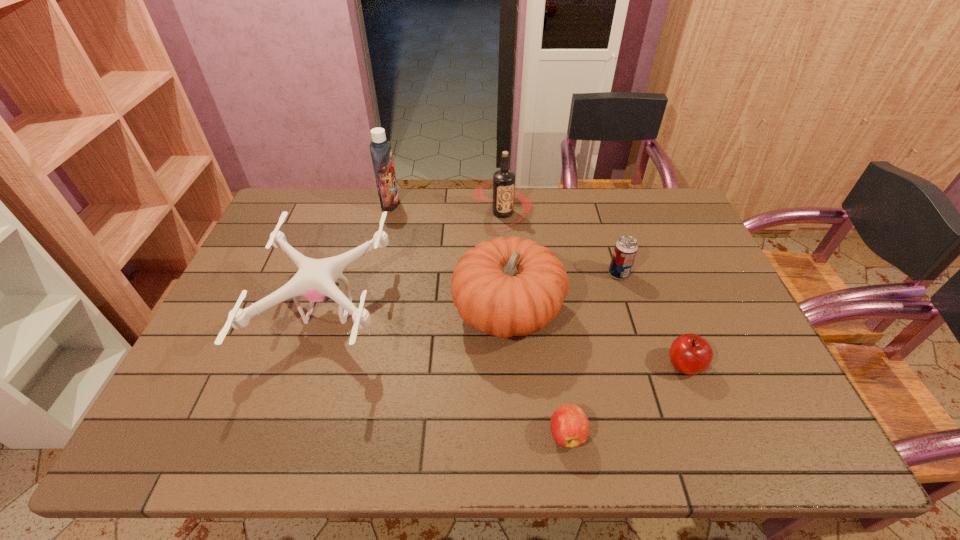
At what (x,y) coordinates should I click in order to perform the action: click on free point that satisfies the following two spatial constraints: 1. on the label of the root beer; 2. on the left side of the farther apple. Please return your answer as a coordinate pair (x, y). Looking at the image, I should click on point(513,365).

I want to click on vacant region that satisfies the following two spatial constraints: 1. on the front label of the shortest object; 2. on the right side of the tallest object, so click(333, 434).

Find the location of `free space in the image that satisfies the following two spatial constraints: 1. on the front label of the shampoo; 2. on the left side of the pumpkin`. free space in the image that satisfies the following two spatial constraints: 1. on the front label of the shampoo; 2. on the left side of the pumpkin is located at coordinates (363, 313).